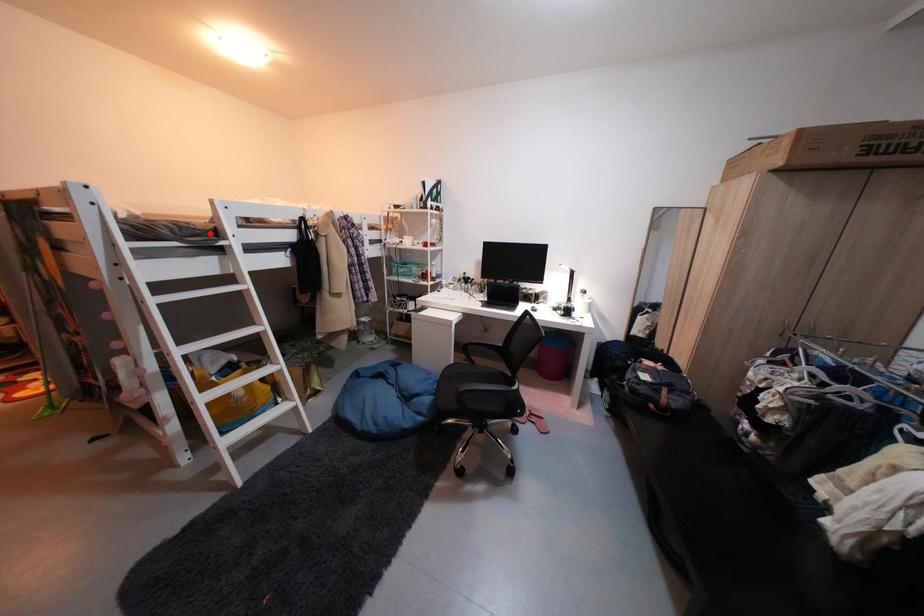
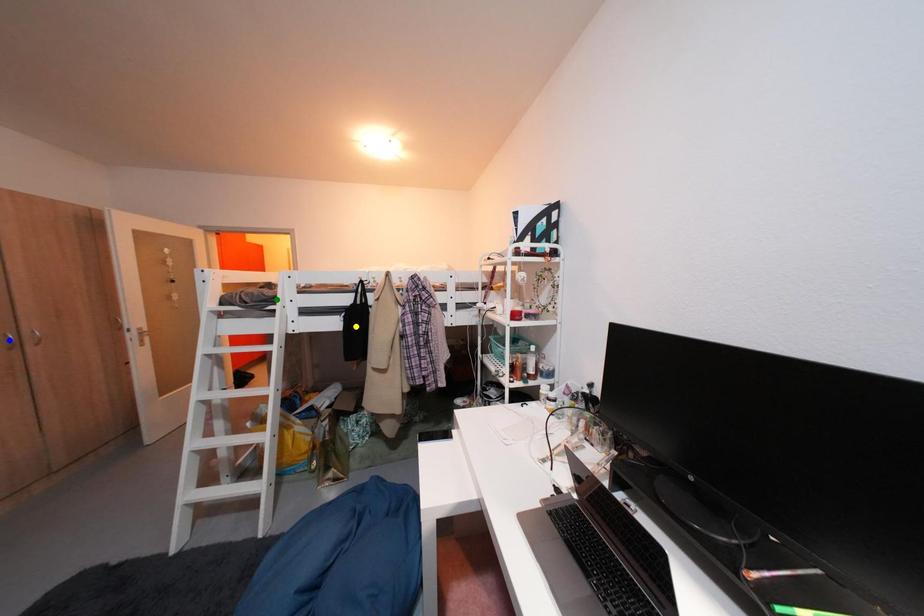
Question: I am providing you with two images of the same scene from different viewpoints. A red point is marked on the first image. You are given multiple points on the second image. Which mark in image 2 goes with the point in image 1?

Choices:
 (A) yellow point
 (B) blue point
 (C) green point

Answer: (C)